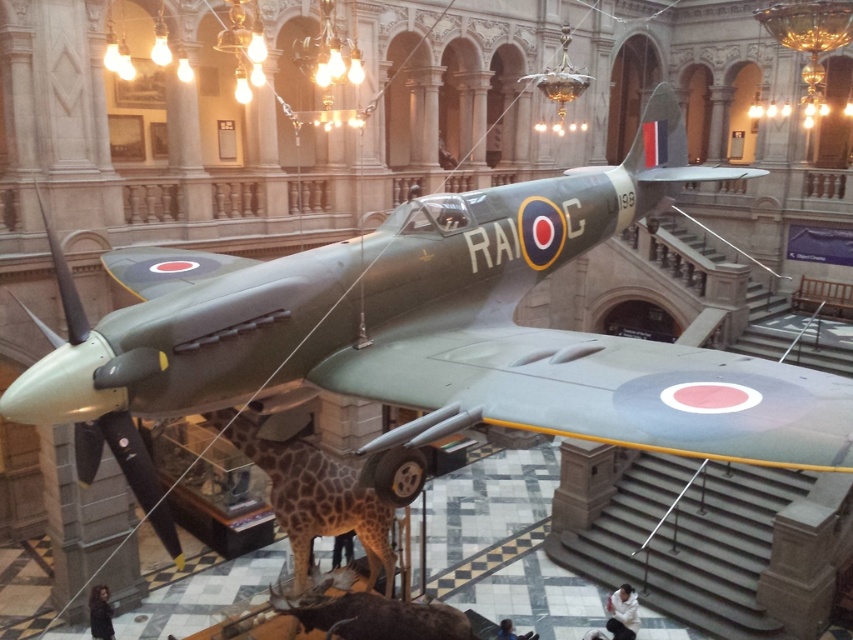
You are a visitor at the museum and want to take a photo of the shiny brown antelope at lower center. However, the spotted fur giraffe at center is blocking your view. Can you move the giraffe to the side to get a clear shot?

The spotted fur giraffe at center is positioned over the shiny brown antelope at lower center, so moving the giraffe would allow you to see the antelope clearly.

You are a museum guide leading a group of visitors. You want to point out both the spotted fur giraffe at center and the shiny brown antelope at lower center to your group. Can you do so without moving your position? Explain why or why not.

The spotted fur giraffe at center and the shiny brown antelope at lower center are 3.41 feet apart. Since the distance between them is only 3.41 feet, you can easily point to both from your current position without needing to move.

Based on the photo, you are a museum visitor who wants to take a photo of both the spotted fur giraffe at center and the shiny brown antelope at lower center. Which one will you need to stand further back to include in the frame?

The spotted fur giraffe at center is much taller than the shiny brown antelope at lower center, so you will need to stand further back to include the spotted fur giraffe at center in the frame.